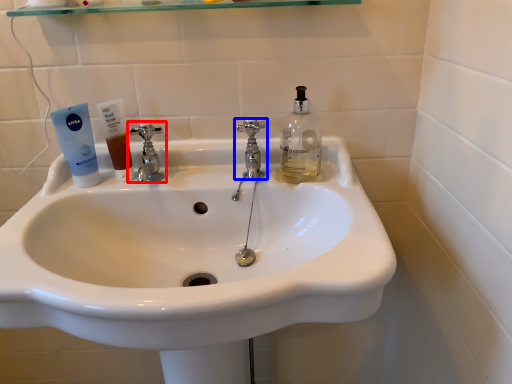
Question: Which object is further to the camera taking this photo, tap (highlighted by a red box) or tap (highlighted by a blue box)?

Choices:
 (A) tap
 (B) tap

Answer: (A)